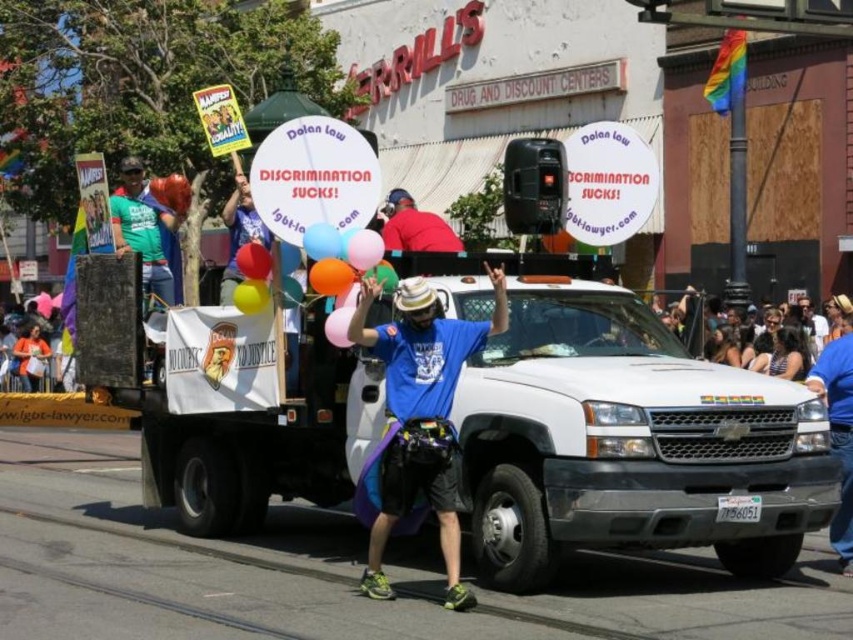
Question: Considering the relative positions of blue cotton shirt at center and pink matte balloon at center in the image provided, where is blue cotton shirt at center located with respect to pink matte balloon at center?

Choices:
 (A) below
 (B) above

Answer: (A)

Question: Estimate the real-world distances between objects in this image. Which object is closer to the red matte shirt at upper center?

Choices:
 (A) white matte truck at center
 (B) blue cotton shirt at center
 (C) green t-shirt at left

Answer: (B)

Question: Which point is closer to the camera taking this photo?

Choices:
 (A) (392, 202)
 (B) (340, 330)
 (C) (355, 253)

Answer: (B)

Question: Does pink matte balloon at center come behind translucent plastic balloon at center?

Choices:
 (A) no
 (B) yes

Answer: (A)

Question: Which object appears farthest from the camera in this image?

Choices:
 (A) translucent plastic balloon at center
 (B) rubber balloon at center

Answer: (B)

Question: Does blue cotton shirt at center appear on the left side of pink matte balloon at center?

Choices:
 (A) yes
 (B) no

Answer: (B)